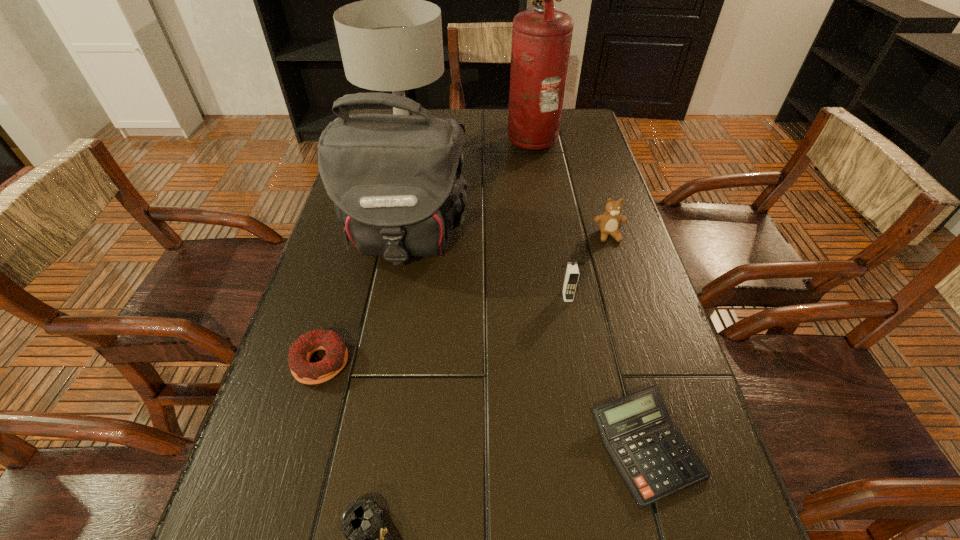
Locate an element on the screen. The width and height of the screenshot is (960, 540). free space that satisfies the following two spatial constraints: 1. on the front side of the calculator; 2. on the right side of the sixth farthest object is located at coordinates (296, 447).

Where is `vacant space that satisfies the following two spatial constraints: 1. on the back side of the calculator; 2. on the front-facing side of the lampshade`? vacant space that satisfies the following two spatial constraints: 1. on the back side of the calculator; 2. on the front-facing side of the lampshade is located at coordinates (565, 145).